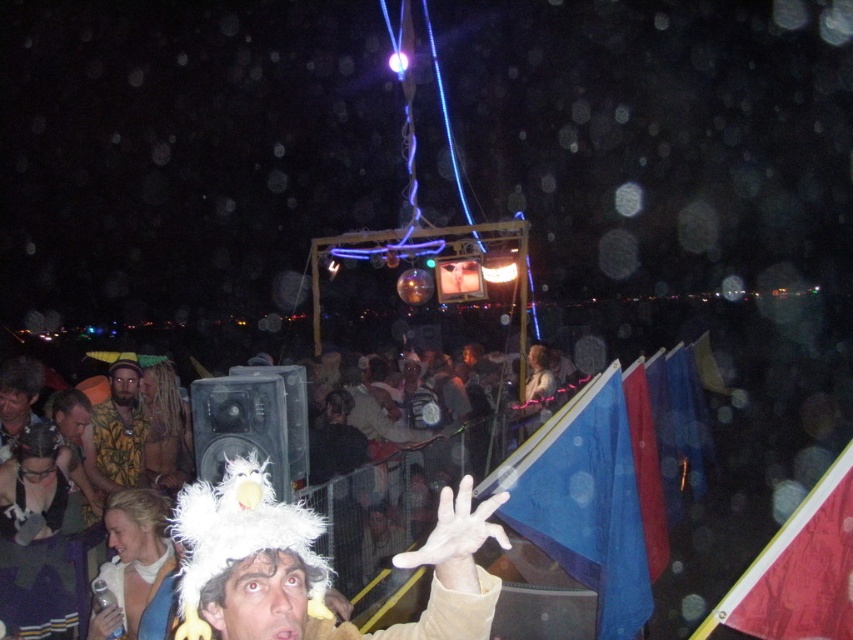
Is point (228, 518) positioned after point (791, 536)?

No, (228, 518) is in front of (791, 536).

What are the coordinates of `white fluffy hat at lower center` in the screenshot? It's located at (314, 564).

From the picture: Is blue fabric flag at upper right below red fabric flag at lower right?

Indeed, blue fabric flag at upper right is positioned under red fabric flag at lower right.

From the picture: Who is positioned more to the right, blue fabric flag at upper right or red fabric flag at lower right?

red fabric flag at lower right is more to the right.

Does point (583, 387) come closer to viewer compared to point (788, 520)?

No, it is not.

Identify the location of blue fabric flag at upper right. (584, 502).

Is blue fabric flag at upper right to the right of camouflage shirt at center from the viewer's perspective?

Yes, blue fabric flag at upper right is to the right of camouflage shirt at center.

Where is `blue fabric flag at upper right`? The image size is (853, 640). blue fabric flag at upper right is located at coordinates (584, 502).